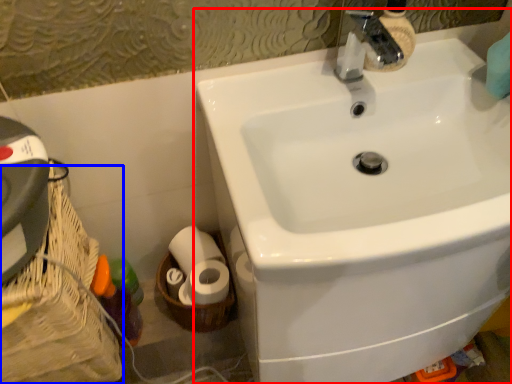
Question: Which object is further to the camera taking this photo, sink (highlighted by a red box) or basket container (highlighted by a blue box)?

Choices:
 (A) sink
 (B) basket container

Answer: (B)